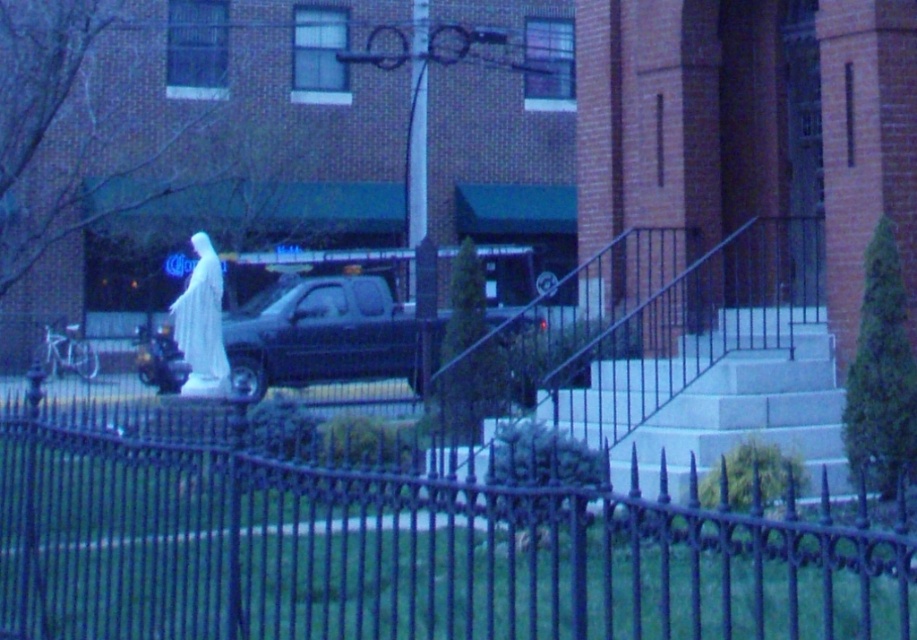
Who is lower down, black wrought iron fence at center or matte black truck at center?

matte black truck at center

Based on the photo, which is above, black wrought iron fence at center or matte black truck at center?

black wrought iron fence at center is higher up.

Between point (15, 566) and point (404, 374), which one is positioned behind?

The point (404, 374) is behind.

At what (x,y) coordinates should I click in order to perform the action: click on black wrought iron fence at center. Please return your answer as a coordinate pair (x, y). This screenshot has width=917, height=640. Looking at the image, I should click on (405, 554).

Who is lower down, matte black truck at center or white marble statue at center?

matte black truck at center

Who is positioned more to the right, matte black truck at center or white marble statue at center?

matte black truck at center is more to the right.

Which is in front, point (238, 385) or point (213, 276)?

Point (213, 276) is more forward.

Where is `matte black truck at center`? The image size is (917, 640). matte black truck at center is located at coordinates (321, 336).

Can you confirm if black wrought iron fence at center is positioned below white marble statue at center?

Indeed, black wrought iron fence at center is positioned under white marble statue at center.

Can you confirm if black wrought iron fence at center is positioned to the right of white marble statue at center?

Indeed, black wrought iron fence at center is positioned on the right side of white marble statue at center.

Who is more forward, (899, 556) or (202, 307)?

Point (899, 556) is more forward.

This screenshot has width=917, height=640. Identify the location of black wrought iron fence at center. (405, 554).